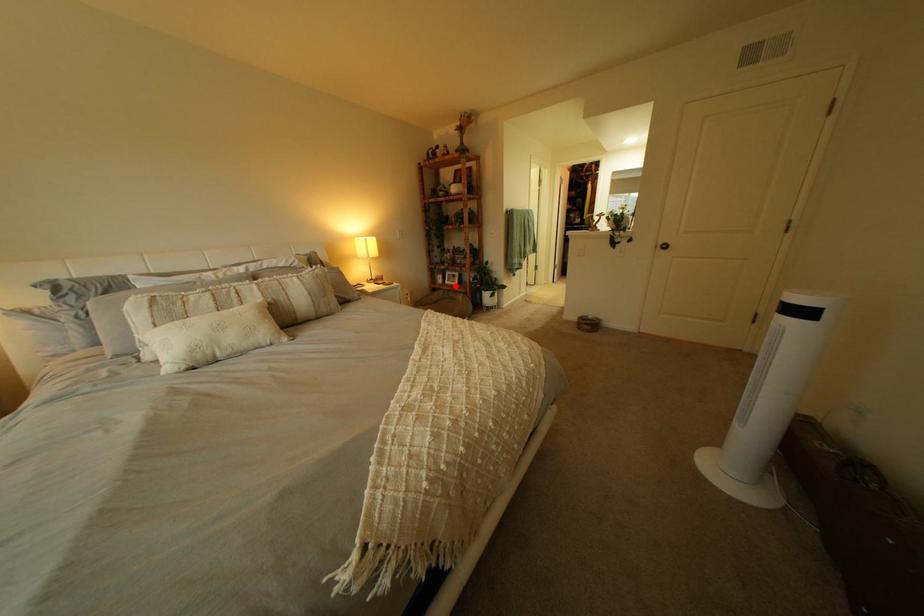
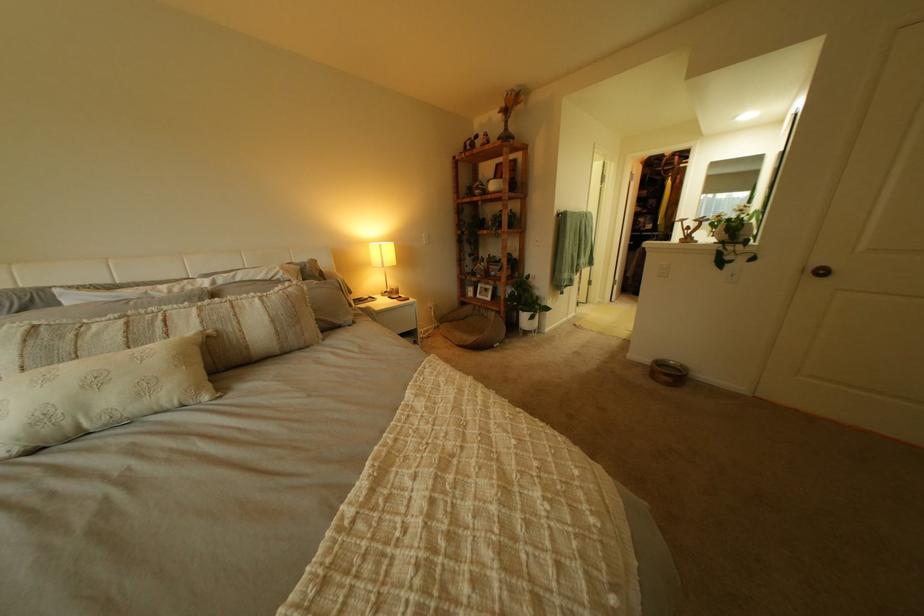
Question: I am providing you with two images of the same scene from different viewpoints. A red point is shown in image1. For the corresponding object point in image2, is it positioned nearer or farther from the camera?

Choices:
 (A) Nearer
 (B) Farther

Answer: (B)